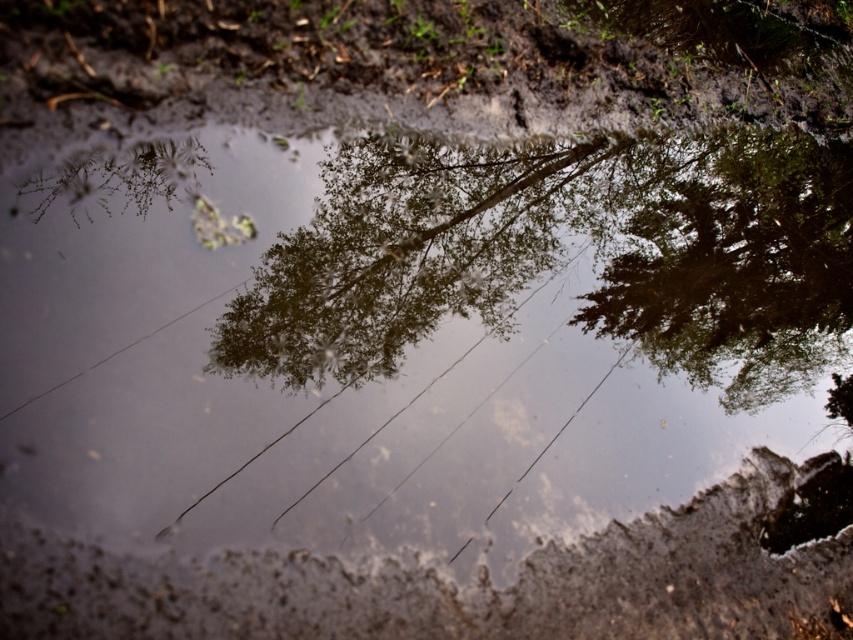
You are a photographer trying to capture the reflection of the green leafy tree at center and the green leafy tree at upper right in the muddy puddle. The camera can only focus on objects within a 5 inch range. Will both trees be in focus?

The green leafy tree at center is 5.27 inches away from the green leafy tree at upper right. Since the distance between them exceeds the camera focus range of 5 inches, they cannot both be in focus simultaneously.